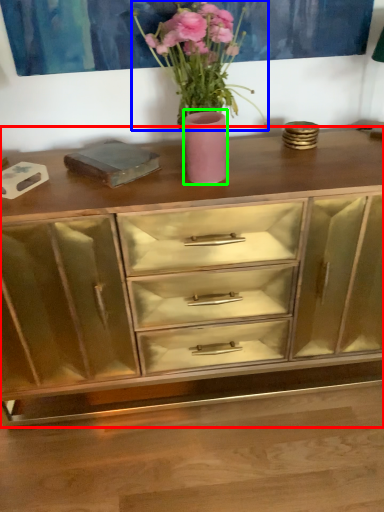
Question: Which is farther away from chest of drawers (highlighted by a red box)? floral arrangement (highlighted by a blue box) or vase (highlighted by a green box)?

Choices:
 (A) floral arrangement
 (B) vase

Answer: (A)